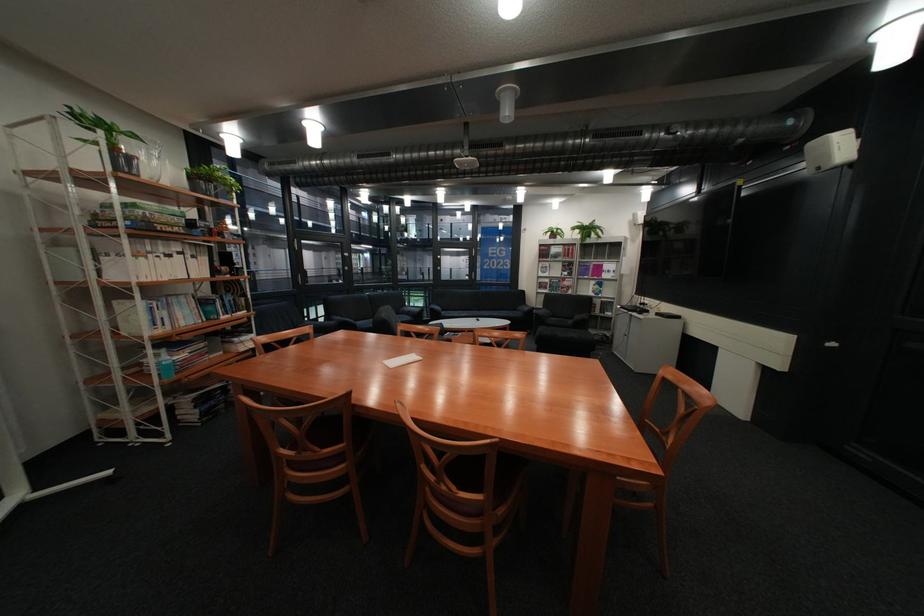
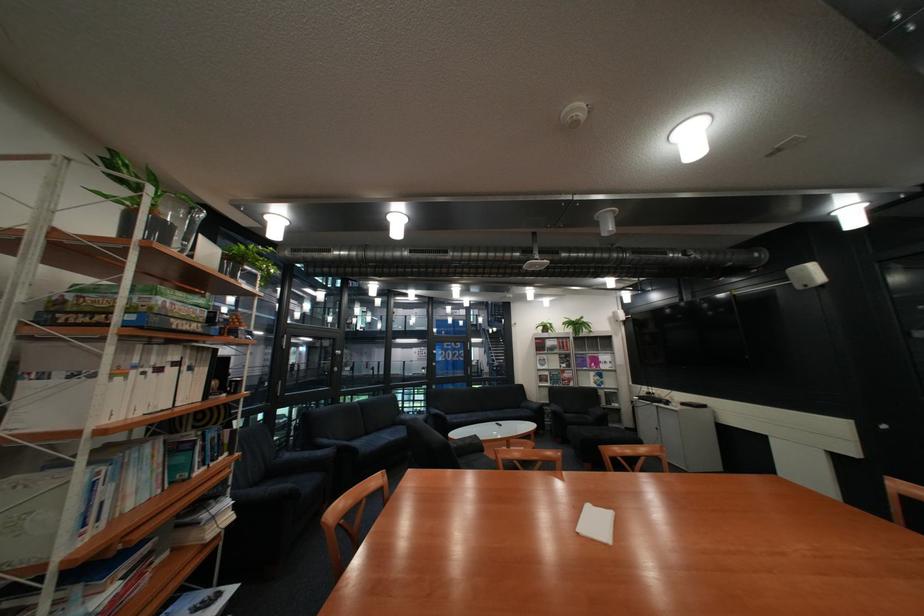
In the second image, find the point that corresponds to the point at 481,315 in the first image.

(490, 418)